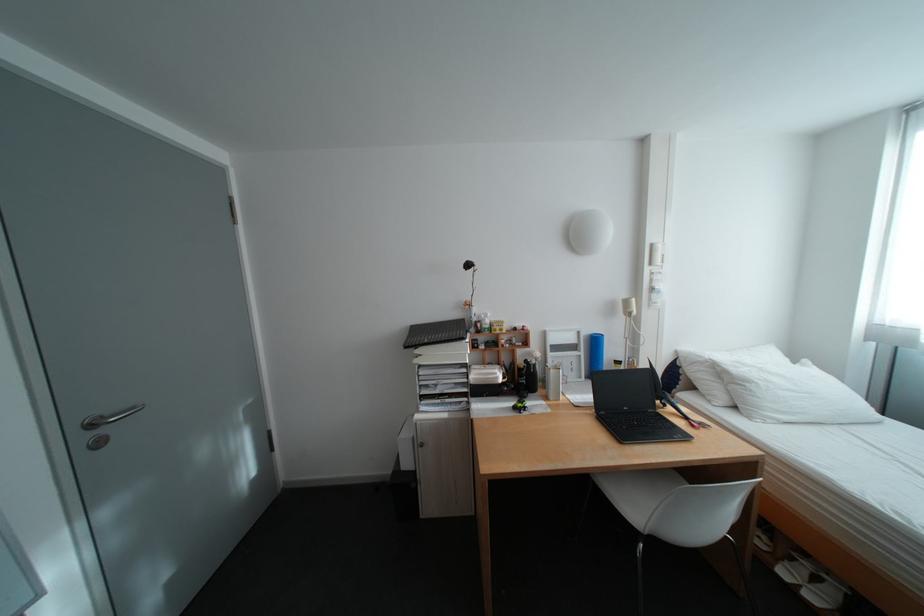
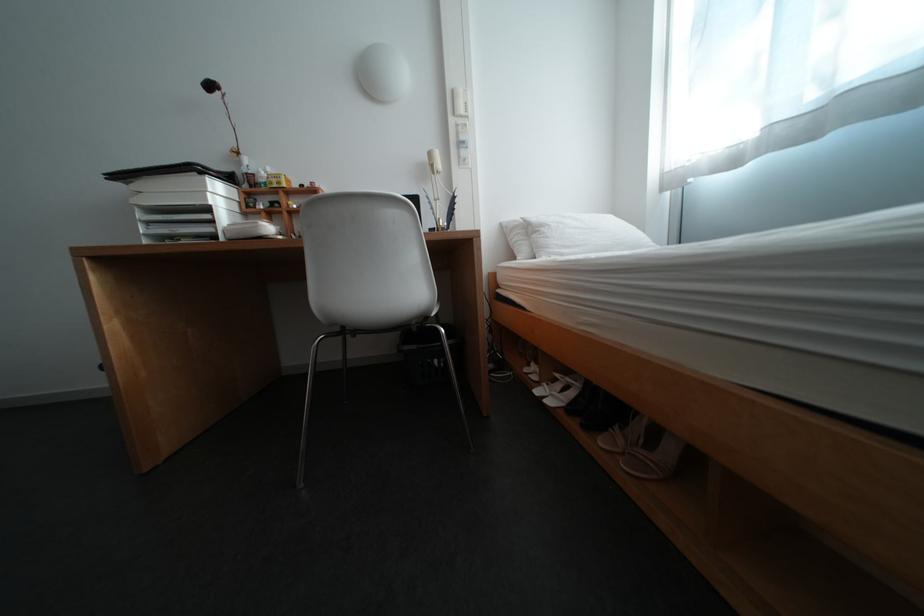
Find the pixel in the second image that matches the point at 761,384 in the first image.

(555, 228)